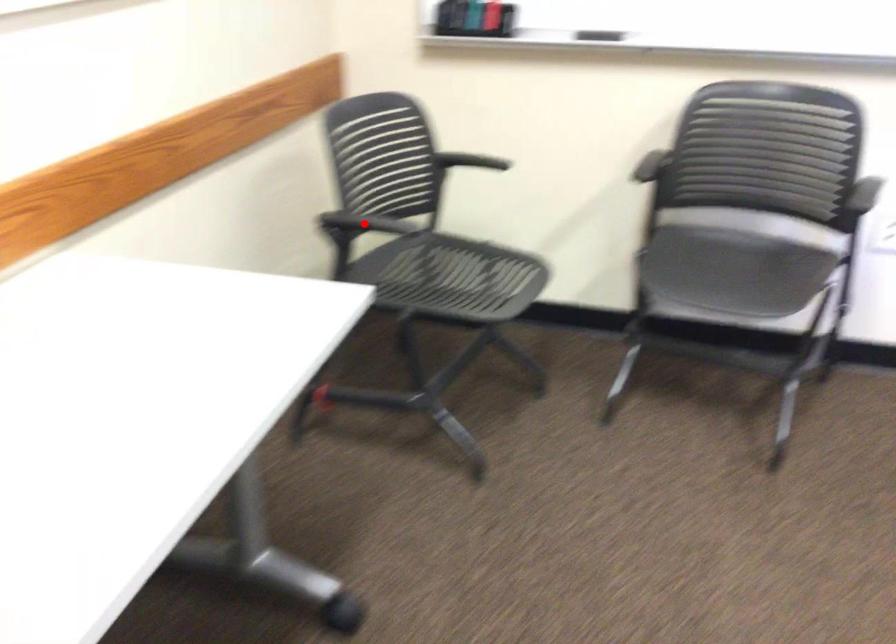
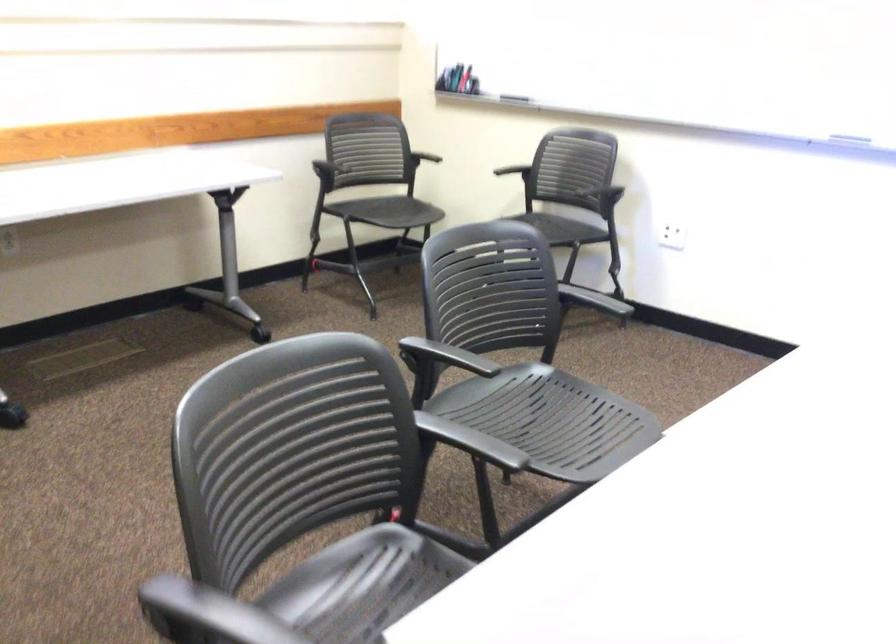
The point at the highlighted location is marked in the first image. Where is the corresponding point in the second image?

(330, 158)